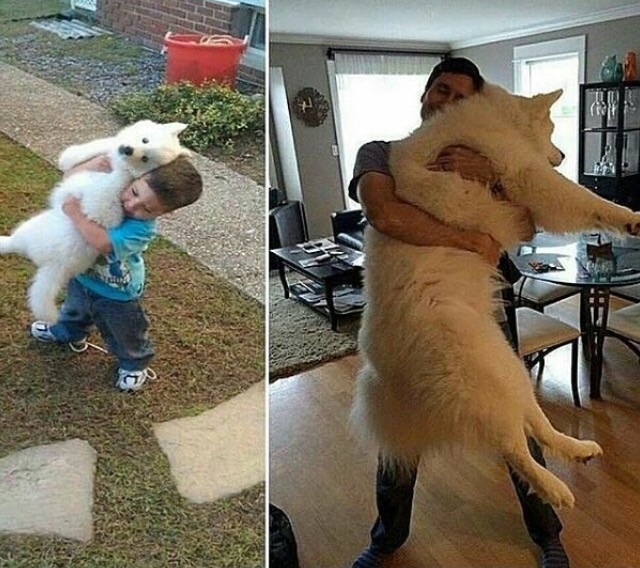
This screenshot has height=568, width=640. In order to click on indoor carpet for walking on in this screenshot , I will do `click(284, 334)`.